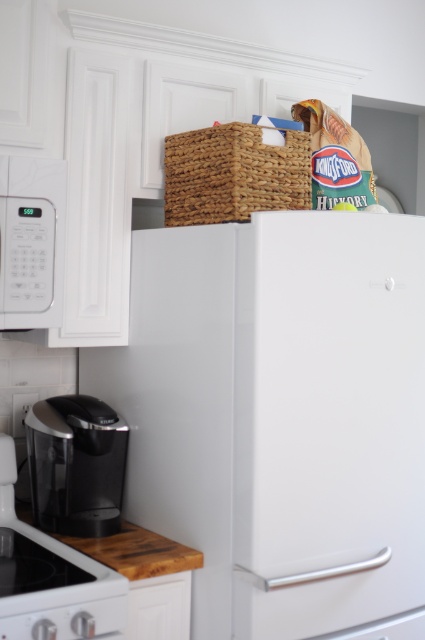
Can you confirm if sleek black coffee maker at lower left is positioned to the left of white matte microwave at upper left?

Incorrect, sleek black coffee maker at lower left is not on the left side of white matte microwave at upper left.

Which is more to the left, sleek black coffee maker at lower left or white matte microwave at upper left?

Positioned to the left is white matte microwave at upper left.

Between point (82, 476) and point (31, 280), which one is positioned behind?

The point (82, 476) is more distant.

Identify the location of sleek black coffee maker at lower left. Image resolution: width=425 pixels, height=640 pixels. (76, 465).

Does white matte refrigerator at center have a greater width compared to sleek black coffee maker at lower left?

Correct, the width of white matte refrigerator at center exceeds that of sleek black coffee maker at lower left.

Is white matte refrigerator at center above sleek black coffee maker at lower left?

Yes, white matte refrigerator at center is above sleek black coffee maker at lower left.

Who is more forward, (333, 387) or (47, 440)?

Point (333, 387)

Image resolution: width=425 pixels, height=640 pixels. Identify the location of white matte refrigerator at center. (277, 416).

Is white matte refrigerator at center above wooden cutting board at lower left?

Yes, white matte refrigerator at center is above wooden cutting board at lower left.

Between white matte refrigerator at center and wooden cutting board at lower left, which one is positioned higher?

white matte refrigerator at center is above.

Between point (226, 400) and point (184, 550), which one is positioned behind?

The point (184, 550) is behind.

At what (x,y) coordinates should I click in order to perform the action: click on white matte refrigerator at center. Please return your answer as a coordinate pair (x, y). Image resolution: width=425 pixels, height=640 pixels. Looking at the image, I should click on (277, 416).